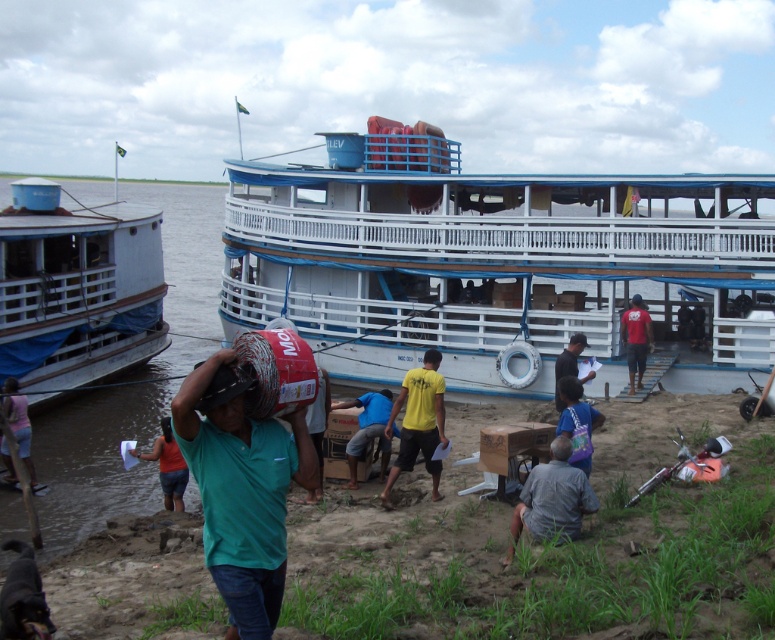
Question: Does green fabric bag at center have a greater width compared to red cotton shirt at center?

Choices:
 (A) yes
 (B) no

Answer: (A)

Question: Based on their relative distances, which object is farther from the white matte boat at center?

Choices:
 (A) blue fabric shirt at center
 (B) yellow matte shirt at center
 (C) green fabric man at center

Answer: (C)

Question: From the image, what is the correct spatial relationship of green fabric bag at center in relation to yellow matte shirt at center?

Choices:
 (A) below
 (B) above

Answer: (A)

Question: Can you confirm if green fabric bag at center is bigger than dark blue shirt at center?

Choices:
 (A) no
 (B) yes

Answer: (B)

Question: Estimate the real-world distances between objects in this image. Which object is closer to the red cotton shirt at center?

Choices:
 (A) yellow matte shirt at center
 (B) dark blue shirt at center
 (C) white matte boat at center

Answer: (B)

Question: Which object appears closest to the camera in this image?

Choices:
 (A) red cotton shirt at center
 (B) gray cotton shirt at lower center
 (C) green fabric bag at center

Answer: (C)